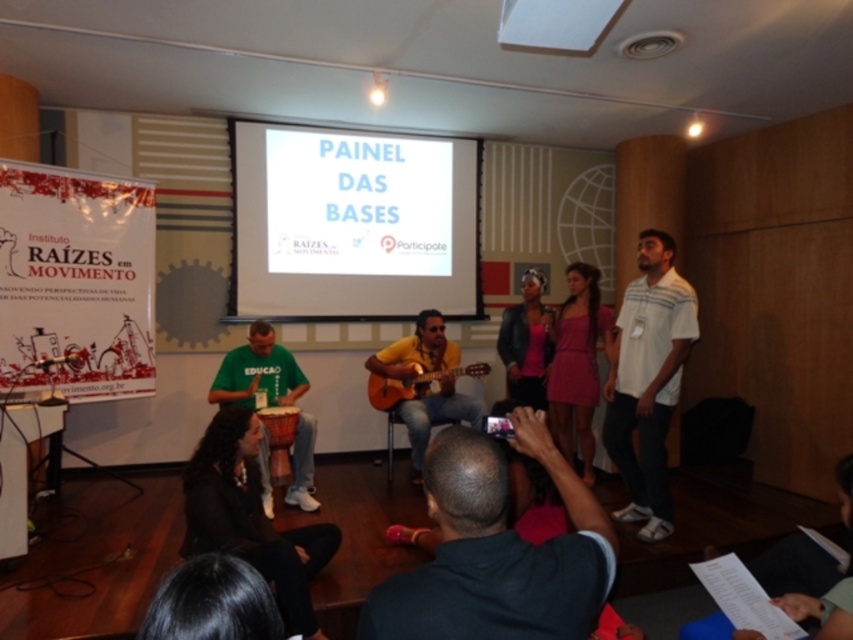
Question: Which of the following is the closest to the observer?

Choices:
 (A) wooden drum at lower center
 (B) black leather jacket at lower left
 (C) green fabric shirt at center

Answer: (B)

Question: Does white striped shirt at right have a smaller size compared to matte black jacket at center?

Choices:
 (A) no
 (B) yes

Answer: (A)

Question: Among these points, which one is farthest from the camera?

Choices:
 (A) (375, 404)
 (B) (196, 468)
 (C) (424, 308)
 (D) (270, 477)

Answer: (C)

Question: Does pink satin dress at center have a greater width compared to green fabric shirt at center?

Choices:
 (A) yes
 (B) no

Answer: (B)

Question: Is matte black jacket at center above acoustic wood guitar at center?

Choices:
 (A) no
 (B) yes

Answer: (B)

Question: Among these points, which one is farthest from the camera?

Choices:
 (A) (474, 474)
 (B) (544, 326)
 (C) (386, 196)

Answer: (C)